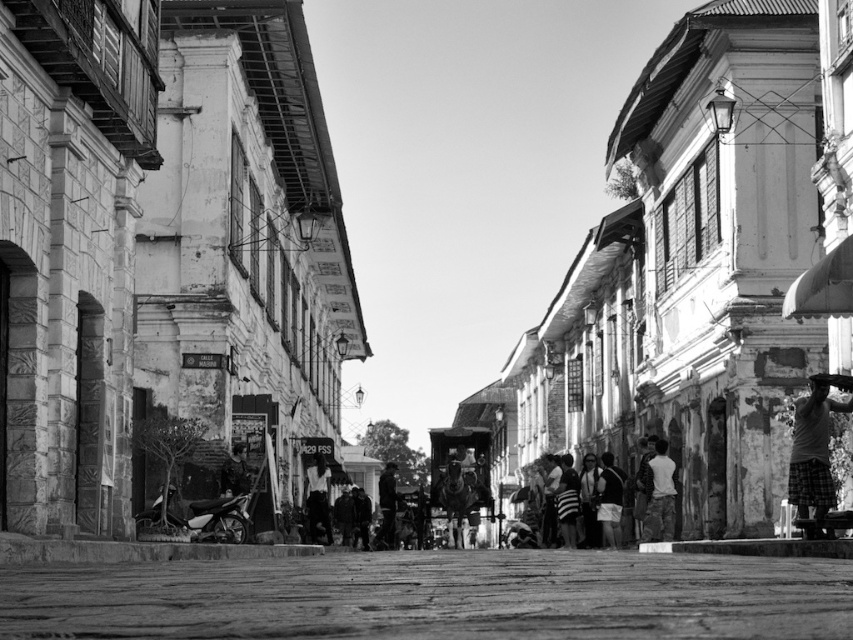
Question: Estimate the real-world distances between objects in this image. Which object is closer to the light gray fabric shirt at lower right?

Choices:
 (A) plaid fabric skateboarder at right
 (B) smooth concrete alley at center

Answer: (A)

Question: Is plaid fabric skateboarder at right positioned behind light gray fabric shirt at lower right?

Choices:
 (A) yes
 (B) no

Answer: (B)

Question: In this image, where is smooth concrete alley at center located relative to plaid fabric skateboarder at right?

Choices:
 (A) right
 (B) left

Answer: (B)

Question: Can you confirm if smooth concrete alley at center is positioned above plaid fabric skateboarder at right?

Choices:
 (A) no
 (B) yes

Answer: (A)

Question: Which object is the closest to the light gray fabric shirt at lower right?

Choices:
 (A) smooth concrete alley at center
 (B) plaid fabric skateboarder at right

Answer: (B)

Question: Which of the following is the farthest from the observer?

Choices:
 (A) plaid fabric skateboarder at right
 (B) light gray fabric shirt at lower right

Answer: (B)